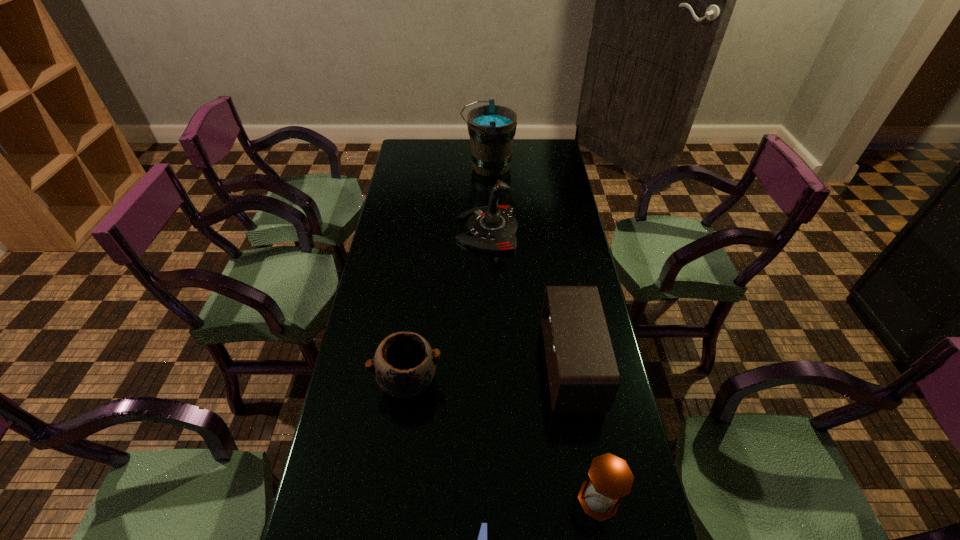
Locate an element on the screen. Image resolution: width=960 pixels, height=540 pixels. radio receiver positioned at the right edge is located at coordinates (583, 376).

Find the location of `hourglass located in the right edge section of the desktop`. hourglass located in the right edge section of the desktop is located at coordinates (610, 478).

The width and height of the screenshot is (960, 540). Identify the location of vacant region at the far edge of the desktop. (468, 156).

Image resolution: width=960 pixels, height=540 pixels. I want to click on free space at the left edge, so click(x=416, y=232).

The width and height of the screenshot is (960, 540). I want to click on vacant space at the right edge of the desktop, so click(x=552, y=248).

The height and width of the screenshot is (540, 960). Find the location of `free point at the far left corner`. free point at the far left corner is located at coordinates point(410,160).

Find the location of a particular element. vacant region at the far right corner of the desktop is located at coordinates (537, 159).

Identify the location of free space between the pottery and the second farthest object. The image size is (960, 540). (448, 306).

Locate an element on the screen. The height and width of the screenshot is (540, 960). vacant space that's between the fifth nearest object and the hourglass is located at coordinates (543, 364).

The height and width of the screenshot is (540, 960). Find the location of `vacant area between the second nearest object and the radio receiver`. vacant area between the second nearest object and the radio receiver is located at coordinates click(x=585, y=433).